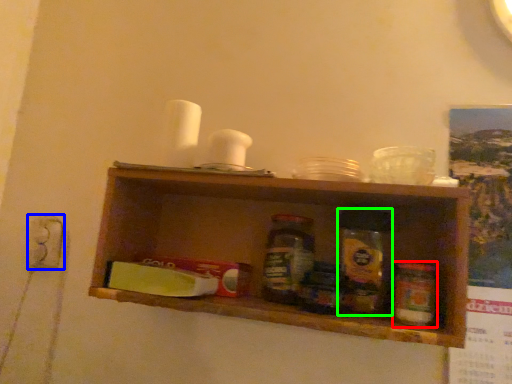
Question: Which object is positioned closest to bottle (highlighted by a red box)? Select from electric outlet (highlighted by a blue box) and glass jar (highlighted by a green box).

Choices:
 (A) electric outlet
 (B) glass jar

Answer: (B)